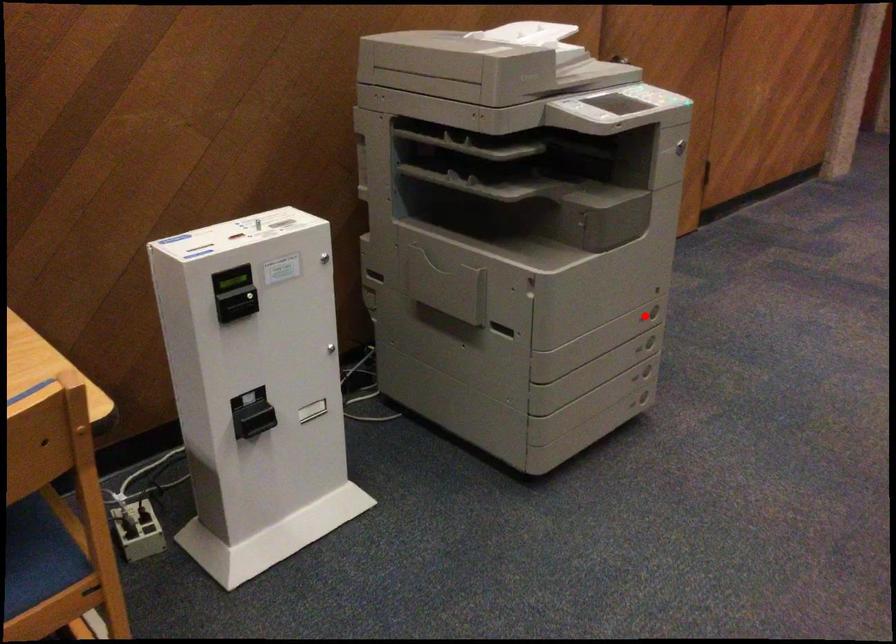
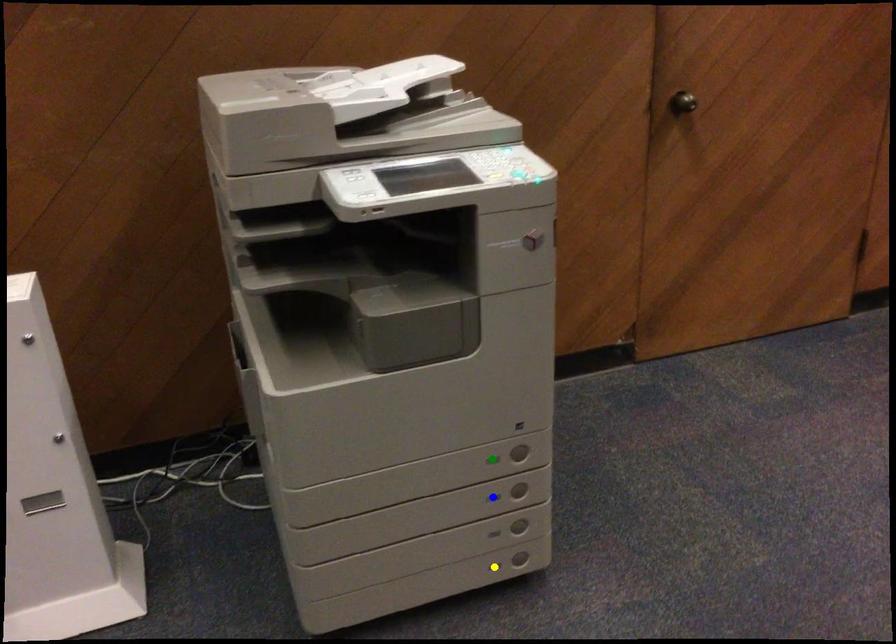
Question: I am providing you with two images of the same scene from different viewpoints. A red point is marked on the first image. You are given multiple points on the second image. Which point in image 2 is actually the same real-world point as the red point in image 1?

Choices:
 (A) green point
 (B) yellow point
 (C) blue point

Answer: (A)